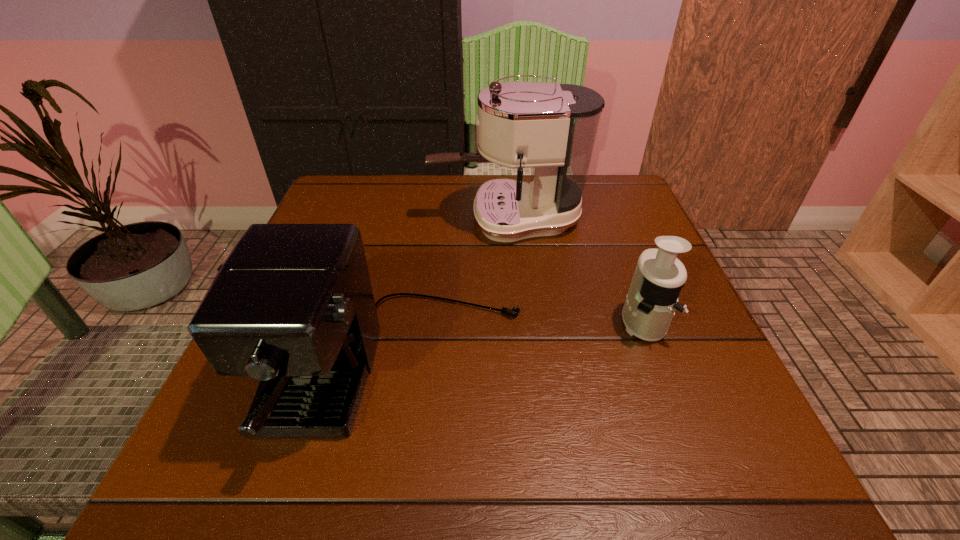
Find the location of a particular element. The height and width of the screenshot is (540, 960). free spot between the taller coffee maker and the second shortest object is located at coordinates (452, 295).

Find the location of `vacant space that is in between the shorter coffee maker and the tallest object`. vacant space that is in between the shorter coffee maker and the tallest object is located at coordinates (452, 295).

Where is `vacant space that's between the second tallest object and the farther coffee maker`? This screenshot has width=960, height=540. vacant space that's between the second tallest object and the farther coffee maker is located at coordinates (452, 295).

This screenshot has width=960, height=540. I want to click on object identified as the closest to the rightmost object, so [x=551, y=128].

Locate which object is the second closest to the shorter coffee maker. Please provide its 2D coordinates. Your answer should be formatted as a tuple, i.e. [(x, y)], where the tuple contains the x and y coordinates of a point satisfying the conditions above.

[(650, 304)]

This screenshot has width=960, height=540. I want to click on vacant region that satisfies the following two spatial constraints: 1. on the back side of the juicer; 2. on the front-facing side of the farther coffee maker, so click(x=604, y=219).

Locate an element on the screen. This screenshot has height=540, width=960. free space that satisfies the following two spatial constraints: 1. on the back side of the shortest object; 2. on the front-facing side of the taller coffee maker is located at coordinates (604, 219).

The image size is (960, 540). I want to click on blank area in the image that satisfies the following two spatial constraints: 1. on the back side of the rightmost object; 2. on the front-facing side of the farther coffee maker, so click(x=604, y=219).

Where is `vacant position in the image that satisfies the following two spatial constraints: 1. on the front-facing side of the farthest object; 2. on the front-facing side of the nearer coffee maker`? The image size is (960, 540). vacant position in the image that satisfies the following two spatial constraints: 1. on the front-facing side of the farthest object; 2. on the front-facing side of the nearer coffee maker is located at coordinates (519, 370).

Find the location of a particular element. free location that satisfies the following two spatial constraints: 1. on the front-facing side of the taller coffee maker; 2. on the front-facing side of the second tallest object is located at coordinates (519, 370).